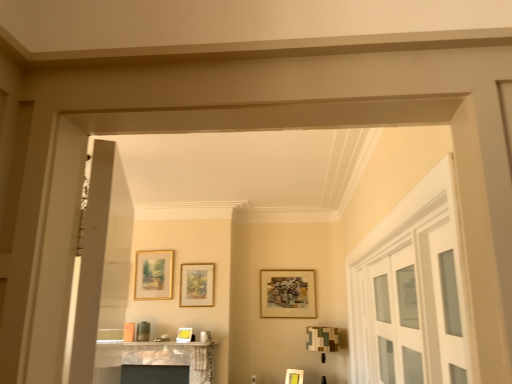
Question: Does wooden picture frame at center, the second picture frame from the right, come behind marble fireplace at lower center?

Choices:
 (A) yes
 (B) no

Answer: (A)

Question: From the image's perspective, would you say wooden picture frame at center, the fourth picture frame in the left-to-right sequence, is shown under marble fireplace at lower center?

Choices:
 (A) no
 (B) yes

Answer: (A)

Question: From a real-world perspective, is wooden picture frame at center, the fourth picture frame in the left-to-right sequence, below marble fireplace at lower center?

Choices:
 (A) yes
 (B) no

Answer: (B)

Question: Is wooden picture frame at center, the second picture frame from the right, facing towards marble fireplace at lower center?

Choices:
 (A) no
 (B) yes

Answer: (A)

Question: Would you say marble fireplace at lower center is part of wooden picture frame at center, the second picture frame from the right,'s contents?

Choices:
 (A) yes
 (B) no

Answer: (B)

Question: Does wooden picture frame at center, the fourth picture frame in the left-to-right sequence, have a smaller size compared to marble fireplace at lower center?

Choices:
 (A) yes
 (B) no

Answer: (A)

Question: From a real-world perspective, is clear glass cabinet at right over matte gold picture frame at upper left, the 1th picture frame positioned from the left?

Choices:
 (A) no
 (B) yes

Answer: (A)

Question: Is clear glass cabinet at right closer to the viewer compared to matte gold picture frame at upper left, the 1th picture frame positioned from the left?

Choices:
 (A) no
 (B) yes

Answer: (B)

Question: Does clear glass cabinet at right have a greater width compared to matte gold picture frame at upper left, which is counted as the 5th picture frame, starting from the right?

Choices:
 (A) yes
 (B) no

Answer: (A)

Question: Can you confirm if clear glass cabinet at right is taller than matte gold picture frame at upper left, which is counted as the 5th picture frame, starting from the right?

Choices:
 (A) yes
 (B) no

Answer: (A)

Question: Is the depth of clear glass cabinet at right greater than that of matte gold picture frame at upper left, which is counted as the 5th picture frame, starting from the right?

Choices:
 (A) yes
 (B) no

Answer: (B)

Question: Is clear glass cabinet at right shorter than matte gold picture frame at upper left, which is counted as the 5th picture frame, starting from the right?

Choices:
 (A) no
 (B) yes

Answer: (A)

Question: Can you confirm if matte gold picture frame at center, which ranks as the fifth picture frame in left-to-right order, is taller than matte gold picture frame at center, the third picture frame from the right?

Choices:
 (A) yes
 (B) no

Answer: (B)